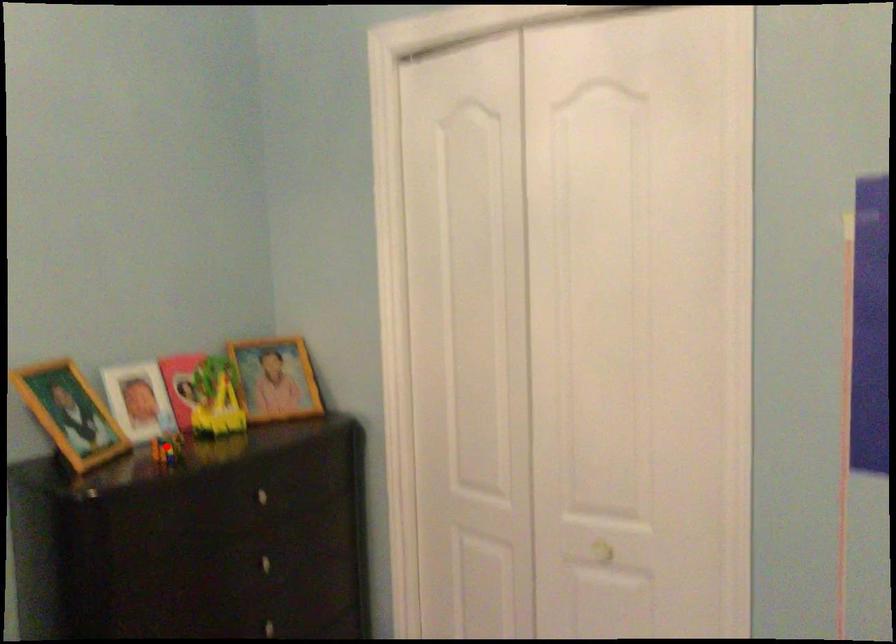
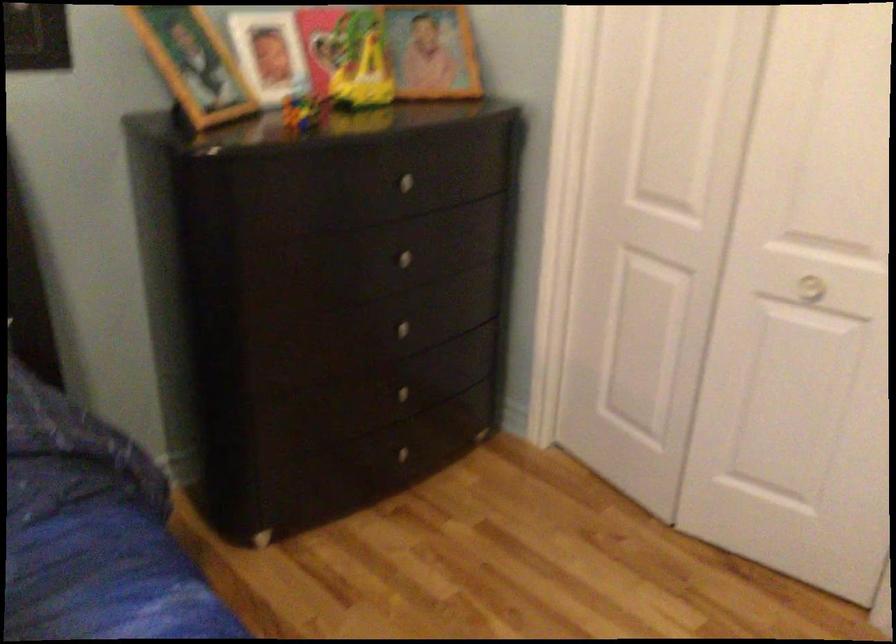
Question: I am providing you with two images of the same scene from different viewpoints. Image1 has a red point marked. In image2, the corresponding 3D location appears at what relative position? Reply with the corresponding letter.

Choices:
 (A) Closer
 (B) Farther

Answer: (A)